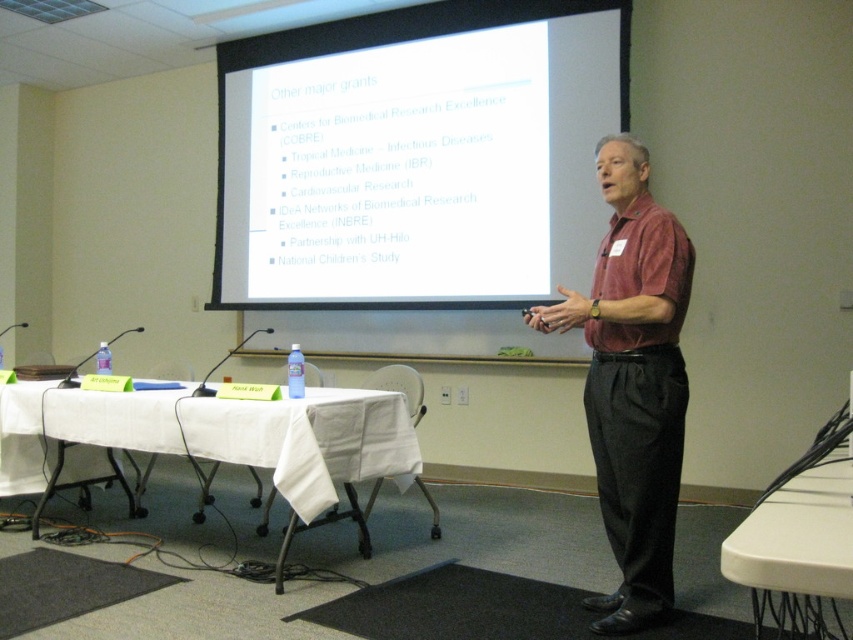
Question: Which point is closer to the camera?

Choices:
 (A) white plastic table at lower right
 (B) white matte projector screen at upper center

Answer: (A)

Question: Can you confirm if white matte projector screen at upper center is wider than matte red shirt at center?

Choices:
 (A) no
 (B) yes

Answer: (B)

Question: Which is farther from the matte red shirt at center?

Choices:
 (A) white plastic table at lower right
 (B) white cloth table at lower left
 (C) white matte projector screen at upper center

Answer: (C)

Question: Does white matte projector screen at upper center appear over matte red shirt at center?

Choices:
 (A) no
 (B) yes

Answer: (B)

Question: Which object is farther from the camera taking this photo?

Choices:
 (A) matte red shirt at center
 (B) white matte projector screen at upper center
 (C) white plastic table at lower right

Answer: (B)

Question: Can you confirm if white matte projector screen at upper center is thinner than matte red shirt at center?

Choices:
 (A) yes
 (B) no

Answer: (B)